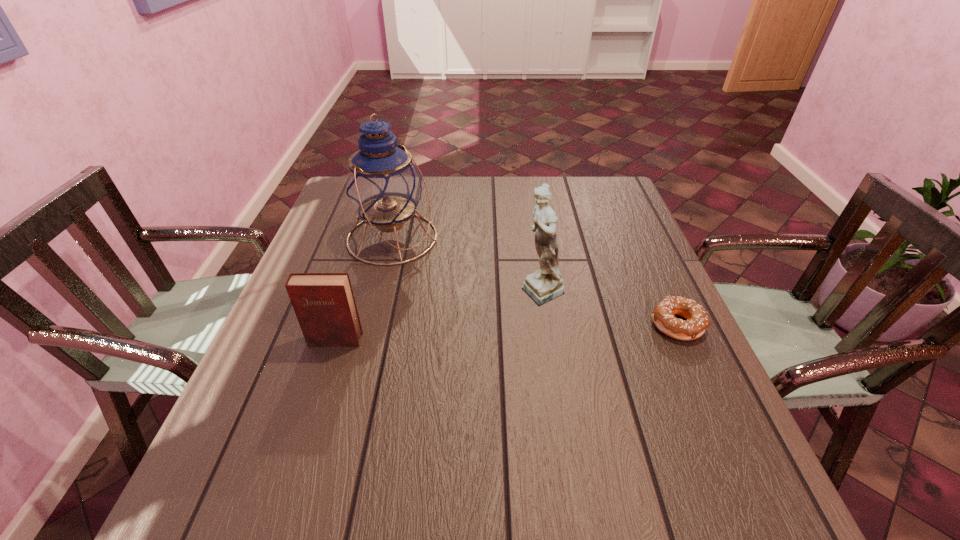
This screenshot has height=540, width=960. Identify the location of free space located on the front-facing side of the lantern. (455, 272).

Find the location of a particular element. free space located 0.170m on the front-facing side of the lantern is located at coordinates point(472,282).

You are a GUI agent. You are given a task and a screenshot of the screen. Output one action in this format:
    pyautogui.click(x=<x>, y=<y>)
    Task: Click on the free location located 0.360m on the front-facing side of the second object from right to left
    The width and height of the screenshot is (960, 540).
    Given the screenshot: What is the action you would take?
    pyautogui.click(x=390, y=375)

The width and height of the screenshot is (960, 540). I want to click on vacant space located 0.340m on the front-facing side of the second object from right to left, so coord(399,370).

You are a GUI agent. You are given a task and a screenshot of the screen. Output one action in this format:
    pyautogui.click(x=<x>, y=<y>)
    Task: Click on the vacant area situated on the front-facing side of the second object from right to left
    The image size is (960, 540).
    Given the screenshot: What is the action you would take?
    pyautogui.click(x=504, y=315)

You are a GUI agent. You are given a task and a screenshot of the screen. Output one action in this format:
    pyautogui.click(x=<x>, y=<y>)
    Task: Click on the object that is positioned at the far edge
    
    Given the screenshot: What is the action you would take?
    pyautogui.click(x=383, y=184)

This screenshot has width=960, height=540. In order to click on diary at the left edge in this screenshot , I will do 324,304.

Locate an element on the screen. lantern present at the left edge is located at coordinates (383, 184).

Where is `object at the right edge`? The image size is (960, 540). object at the right edge is located at coordinates (697, 320).

I want to click on object situated at the far left corner, so click(x=383, y=184).